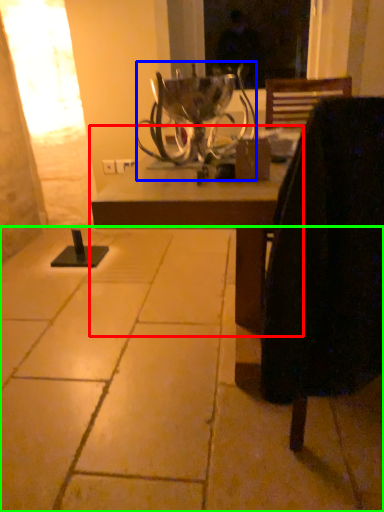
Question: Which is farther away from table (highlighted by a red box)? candle holder (highlighted by a blue box) or concrete (highlighted by a green box)?

Choices:
 (A) candle holder
 (B) concrete

Answer: (A)